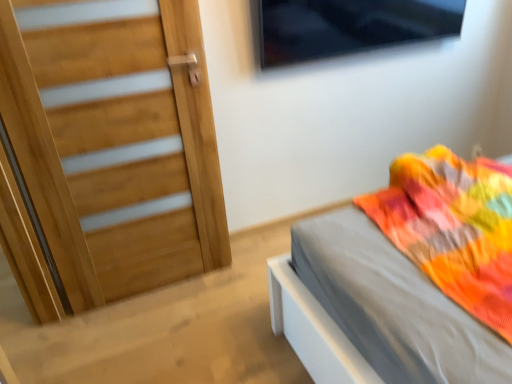
Question: Can you confirm if transparent glass window at upper center is positioned to the right of matte gray bed at right?

Choices:
 (A) no
 (B) yes

Answer: (B)

Question: Is transparent glass window at upper center behind matte gray bed at right?

Choices:
 (A) no
 (B) yes

Answer: (B)

Question: From the image's perspective, is transparent glass window at upper center below matte gray bed at right?

Choices:
 (A) yes
 (B) no

Answer: (B)

Question: Does transparent glass window at upper center have a lesser width compared to matte gray bed at right?

Choices:
 (A) no
 (B) yes

Answer: (B)

Question: Are transparent glass window at upper center and matte gray bed at right located far from each other?

Choices:
 (A) no
 (B) yes

Answer: (B)

Question: From the image's perspective, is transparent glass window at upper center on matte gray bed at right?

Choices:
 (A) no
 (B) yes

Answer: (B)

Question: Is natural wood door at left positioned with its back to transparent glass window at upper center?

Choices:
 (A) no
 (B) yes

Answer: (A)

Question: Is natural wood door at left bigger than transparent glass window at upper center?

Choices:
 (A) no
 (B) yes

Answer: (B)

Question: From a real-world perspective, is natural wood door at left beneath transparent glass window at upper center?

Choices:
 (A) no
 (B) yes

Answer: (B)

Question: Does natural wood door at left come in front of transparent glass window at upper center?

Choices:
 (A) yes
 (B) no

Answer: (A)

Question: From the image's perspective, would you say natural wood door at left is shown under transparent glass window at upper center?

Choices:
 (A) yes
 (B) no

Answer: (A)

Question: From a real-world perspective, does natural wood door at left stand above transparent glass window at upper center?

Choices:
 (A) no
 (B) yes

Answer: (A)

Question: Is transparent glass window at upper center closer to the viewer compared to natural wood door at left?

Choices:
 (A) yes
 (B) no

Answer: (B)